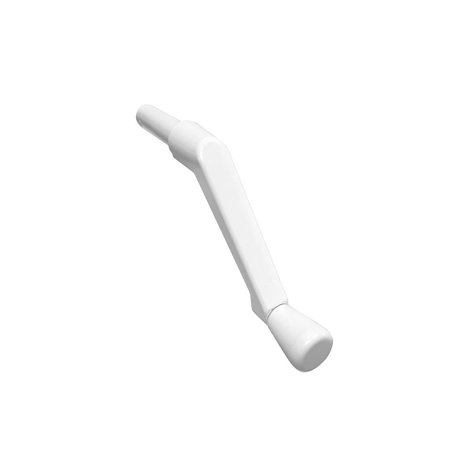
Identify the location of white handle. (245, 234).